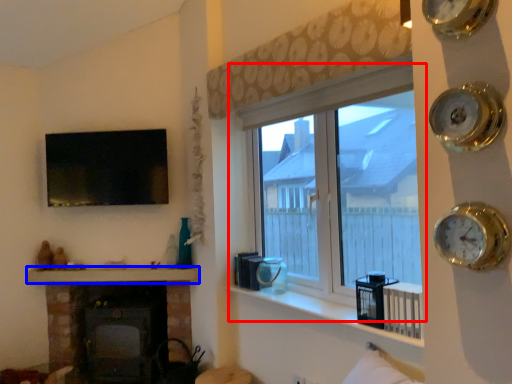
Question: Which of the following is the farthest to the observer, window (highlighted by a red box) or mantle (highlighted by a blue box)?

Choices:
 (A) window
 (B) mantle

Answer: (B)